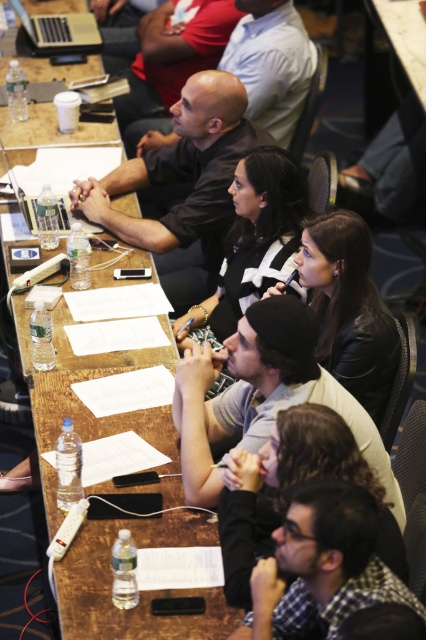
Consider the image. Who is higher up, clear wood table at center or matte black laptop at center?

matte black laptop at center is higher up.

Which of these two, clear wood table at center or matte black laptop at center, stands taller?

clear wood table at center is taller.

I want to click on clear wood table at center, so click(100, 353).

This screenshot has width=426, height=640. I want to click on clear wood table at center, so click(100, 353).

What do you see at coordinates (140, 592) in the screenshot?
I see `clear plastic water bottle at lower left` at bounding box center [140, 592].

Does point (164, 593) come in front of point (74, 168)?

That is True.

Which is in front, point (103, 632) or point (108, 172)?

Point (103, 632) is in front.

Locate an element on the screen. The image size is (426, 640). clear plastic water bottle at lower left is located at coordinates point(140,592).

Which of these two, checkered fabric shirt at lower right or matte black laptop at center, stands shorter?

checkered fabric shirt at lower right

Who is more distant from viewer, (238, 632) or (19, 180)?

Point (19, 180)

You are a GUI agent. You are given a task and a screenshot of the screen. Output one action in this format:
    pyautogui.click(x=<x>, y=<y>)
    Task: Click on the checkered fabric shirt at lower right
    This screenshot has height=640, width=426.
    Given the screenshot: What is the action you would take?
    pyautogui.click(x=322, y=564)